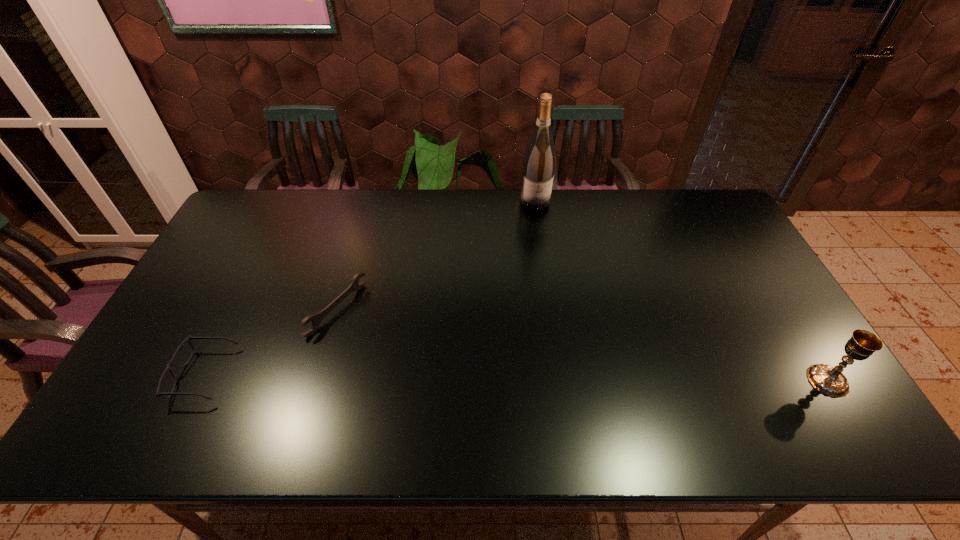
Locate an element on the screen. This screenshot has height=540, width=960. vacant spot on the desktop that is between the spectacles and the chalice and is positioned on the label of the tallest object is located at coordinates (575, 378).

Where is `free space on the desktop that is between the spectacles and the rightmost object and is positioned on the open ends of the wrench`? Image resolution: width=960 pixels, height=540 pixels. free space on the desktop that is between the spectacles and the rightmost object and is positioned on the open ends of the wrench is located at coordinates (460, 377).